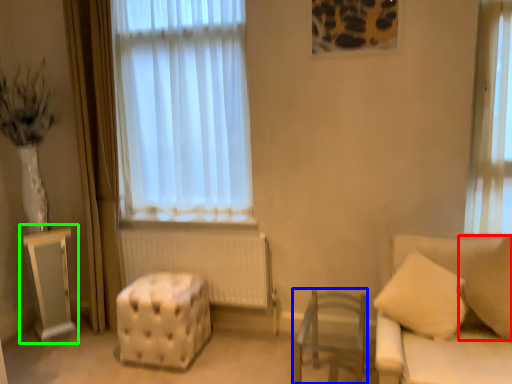
Question: Estimate the real-world distances between objects in this image. Which object is closer to pillow (highlighted by a red box), furniture (highlighted by a blue box) or table (highlighted by a green box)?

Choices:
 (A) furniture
 (B) table

Answer: (A)